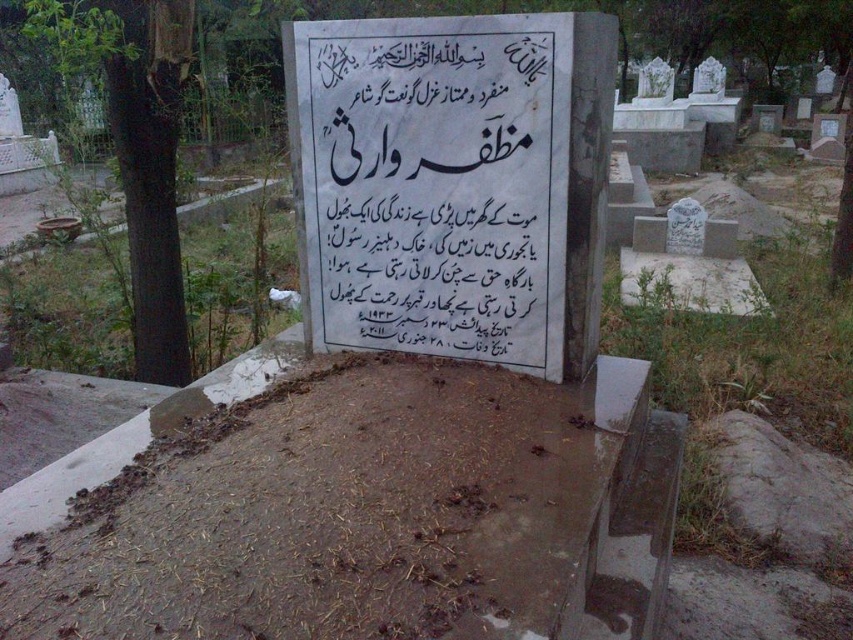
This screenshot has width=853, height=640. What are the coordinates of `brown dirt at lower center` in the screenshot? It's located at (337, 516).

Is brown dirt at lower center positioned at the back of white marble sign at center?

No.

Does point (369, 372) come in front of point (554, 168)?

That is False.

The image size is (853, 640). What are the coordinates of `brown dirt at lower center` in the screenshot? It's located at (337, 516).